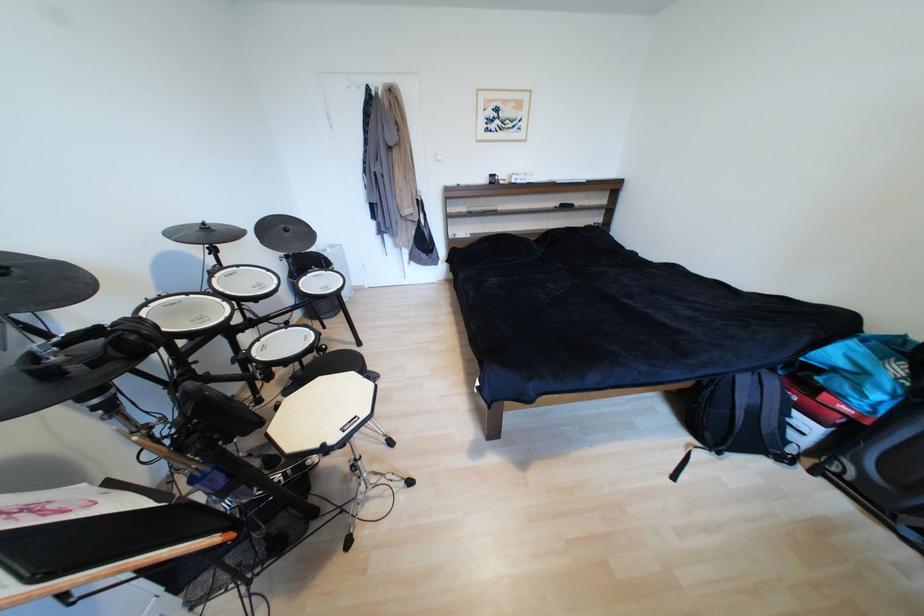
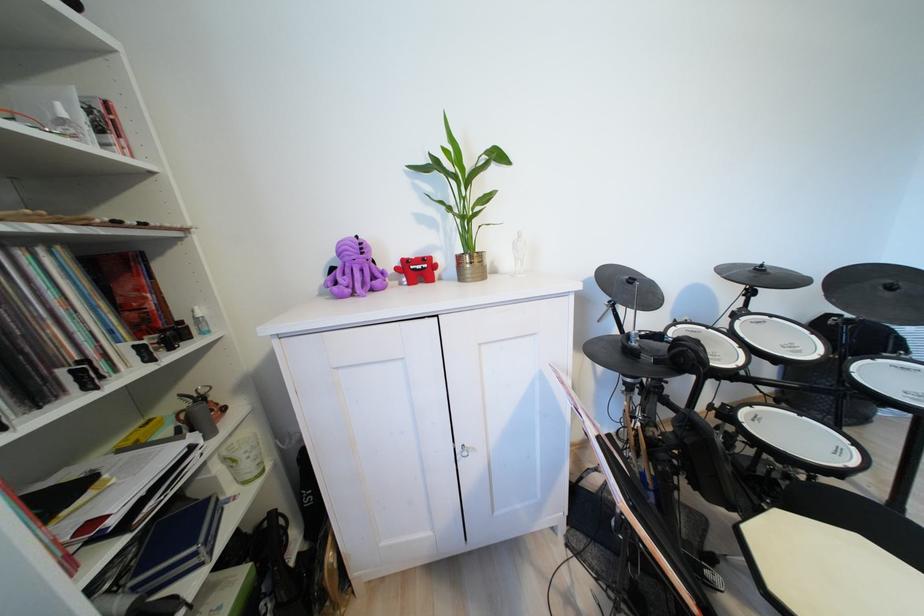
Question: The camera is either moving clockwise (left) or counter-clockwise (right) around the object. The first image is from the beginning of the video and the second image is from the end. Is the camera moving left or right when shooting the video?

Choices:
 (A) Left
 (B) Right

Answer: (B)